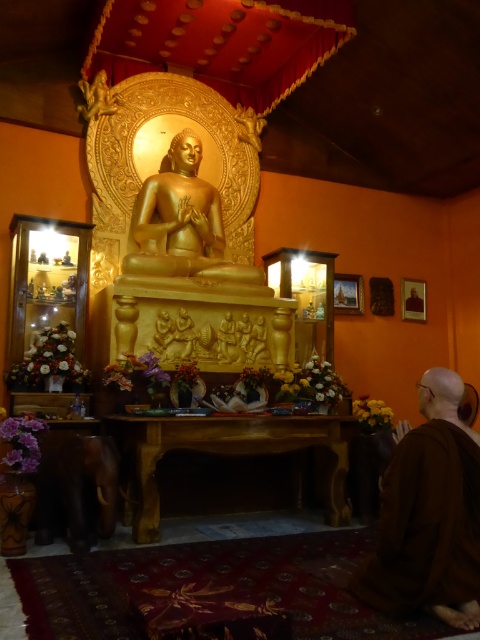
Question: Can you confirm if brown cloth at lower right is positioned below gold polished statue at center?

Choices:
 (A) yes
 (B) no

Answer: (A)

Question: Which of the following is the closest to the observer?

Choices:
 (A) (84, 92)
 (B) (399, 515)

Answer: (B)

Question: Which point appears closest to the camera in this image?

Choices:
 (A) (475, 474)
 (B) (84, 112)
 (C) (155, 237)
 (D) (131, 438)

Answer: (A)

Question: Among these objects, which one is nearest to the camera?

Choices:
 (A) brown cloth at lower right
 (B) wooden altar at center
 (C) gold polished statue at center

Answer: (A)

Question: Is brown cloth at lower right above gold polished statue at center?

Choices:
 (A) yes
 (B) no

Answer: (B)

Question: Considering the relative positions of brown cloth at lower right and gold polished statue at center in the image provided, where is brown cloth at lower right located with respect to gold polished statue at center?

Choices:
 (A) below
 (B) above

Answer: (A)